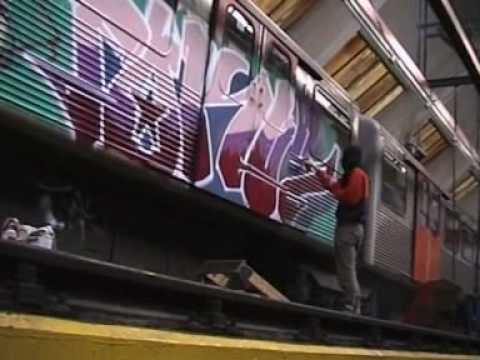
This screenshot has height=360, width=480. What are the coordinates of `vertical black cable` in the screenshot? It's located at 454,109.